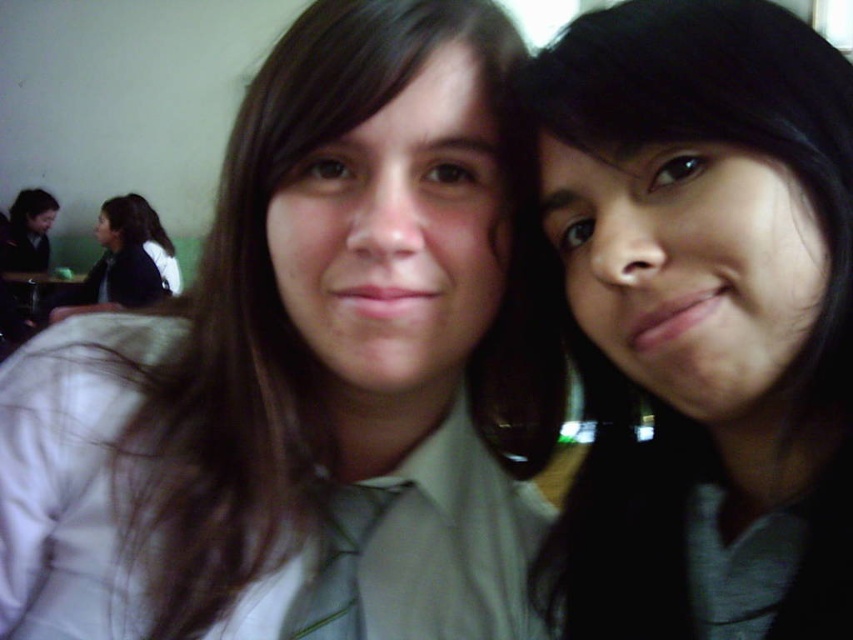
Question: Does matte gray shirt at right come behind dark brown hair at left?

Choices:
 (A) no
 (B) yes

Answer: (A)

Question: Where is green fabric tie at center located in relation to dark brown hair at left in the image?

Choices:
 (A) above
 (B) below

Answer: (B)

Question: Is matte gray shirt at center positioned before dark brown hair at left?

Choices:
 (A) no
 (B) yes

Answer: (B)

Question: Considering the real-world distances, which object is farthest from the matte gray shirt at center?

Choices:
 (A) green fabric tie at center
 (B) dark brown hair at left

Answer: (B)

Question: Which object is positioned closest to the matte gray shirt at center?

Choices:
 (A) dark brown hair at left
 (B) matte gray shirt at right
 (C) green fabric tie at center

Answer: (B)

Question: Among these points, which one is nearest to the camera?

Choices:
 (A) (402, 472)
 (B) (126, 276)
 (C) (795, 99)
 (D) (344, 588)

Answer: (C)